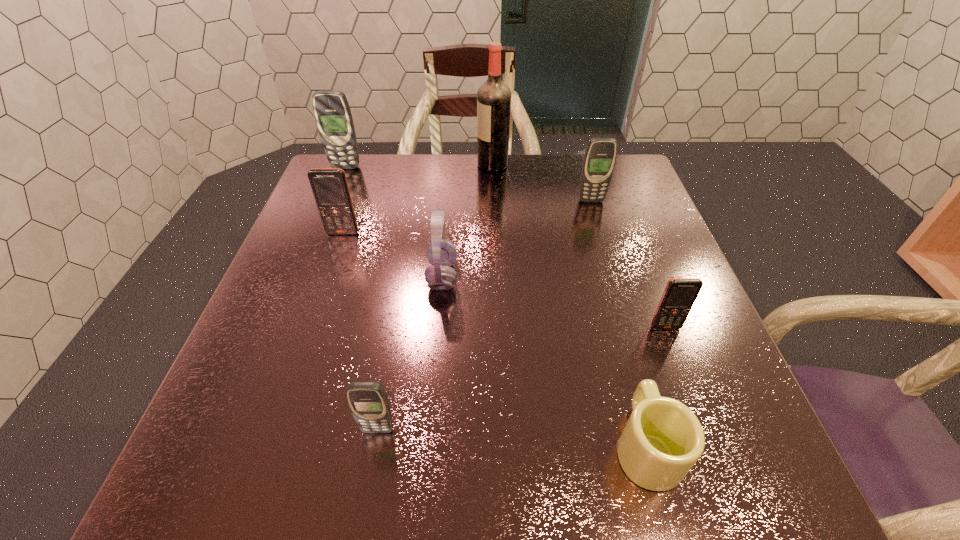
You are a GUI agent. You are given a task and a screenshot of the screen. Output one action in this format:
    pyautogui.click(x=<x>, y=<y>)
    Task: Click on the blank region between the rightmost gray cellular telephone and the shortest object
    The image size is (960, 540).
    Given the screenshot: What is the action you would take?
    pyautogui.click(x=618, y=323)

At what (x,y) coordinates should I click in order to perform the action: click on free space between the liquor and the fourth nearest object. Please return your answer as a coordinate pair (x, y). This screenshot has height=540, width=960. Looking at the image, I should click on (468, 220).

The image size is (960, 540). In order to click on empty space that is in between the seventh shortest object and the second cellular telephone from right to left in this screenshot , I will do `click(468, 184)`.

Locate an element on the screen. The height and width of the screenshot is (540, 960). vacant space that's between the mug and the liquor is located at coordinates (569, 305).

The image size is (960, 540). Identify the location of vacant area between the fifth nearest object and the rightmost object. [504, 280].

The image size is (960, 540). In order to click on vacant region between the rightmost object and the fifth object from right to left in this screenshot , I will do `click(554, 302)`.

Find the location of a particular element. Image resolution: width=960 pixels, height=540 pixels. free space between the shortest object and the fourth object from right to left is located at coordinates (569, 305).

I want to click on vacant area that lies between the tallest object and the fourth nearest object, so [x=468, y=220].

Find the location of a particular element. object that stands as the closest to the smallest gray cellular telephone is located at coordinates (442, 253).

This screenshot has height=540, width=960. Identify the location of object that stands as the fourth closest to the smallest gray cellular telephone. (x=679, y=295).